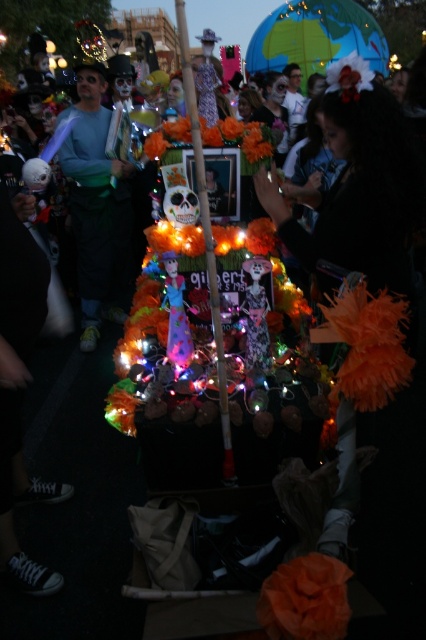
You are a photographer trying to capture the float from the front. You notice two points marked on the float at coordinates point (97,72) and point (190,108). Which point should you focus on to ensure the closest part of the float is in sharp focus?

You should focus on point (97,72) because it is closer to the camera than point (190,108), which is further away.

From the picture: You are a participant in the parade holding a 2.5 meter long pole. You need to attach the pole to both the matte green shirt at center and the wooden stick at center. Is the pole long enough to connect them?

The distance between the matte green shirt at center and the wooden stick at center is 2.77 meters. Since the pole is only 2.5 meters long, it is not long enough to connect them.